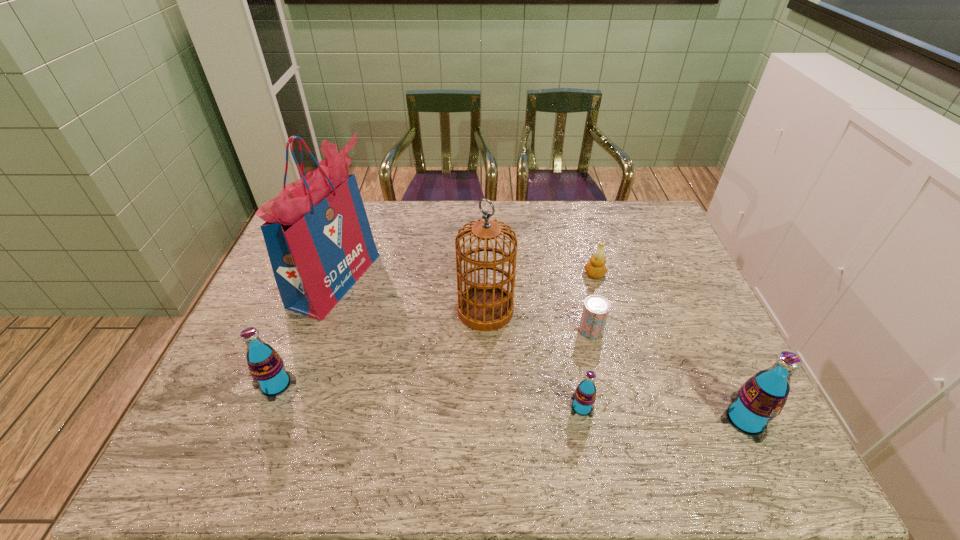
Find the location of a particular element. This screenshot has width=960, height=540. soda that is the closest to the second soda from left to right is located at coordinates (761, 398).

Locate an element on the screen. free space that satisfies the following two spatial constraints: 1. on the back side of the shortest object; 2. on the left side of the fourth shortest object is located at coordinates (298, 330).

The width and height of the screenshot is (960, 540). In order to click on free point that satisfies the following two spatial constraints: 1. on the front-facing side of the fifth object from right to left; 2. on the right side of the tallest object in this screenshot , I will do `click(324, 310)`.

The image size is (960, 540). I want to click on free point that satisfies the following two spatial constraints: 1. on the front-facing side of the rightmost soda; 2. on the left side of the grocery bag, so click(x=286, y=420).